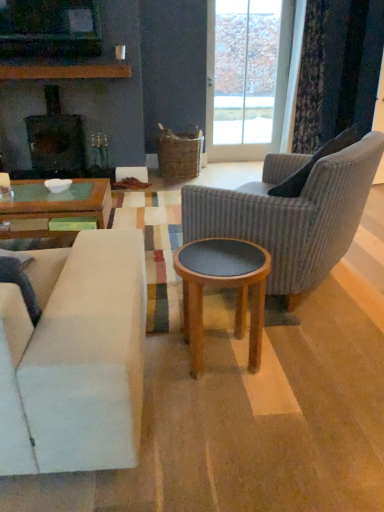
Locate an element on the screen. vacant space in front of wooden round stool at center is located at coordinates (228, 419).